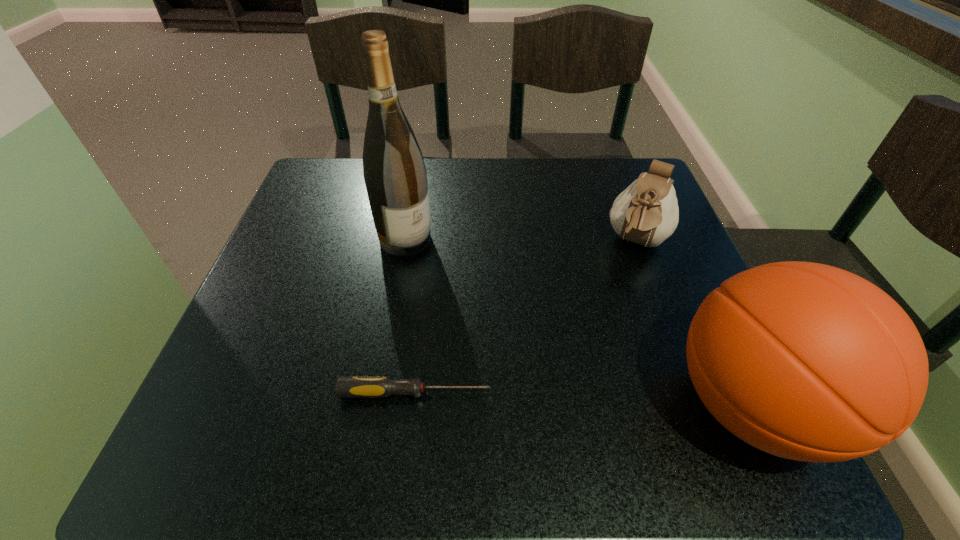
Locate an element on the screen. The width and height of the screenshot is (960, 540). vacant spot on the desktop that is between the screwdriver and the second tallest object and is positioned on the front-facing side of the pouch is located at coordinates (574, 399).

The width and height of the screenshot is (960, 540). In order to click on free space on the desktop that is between the shortest object and the third shortest object and is positioned on the label of the wine bottle in this screenshot , I will do `click(607, 400)`.